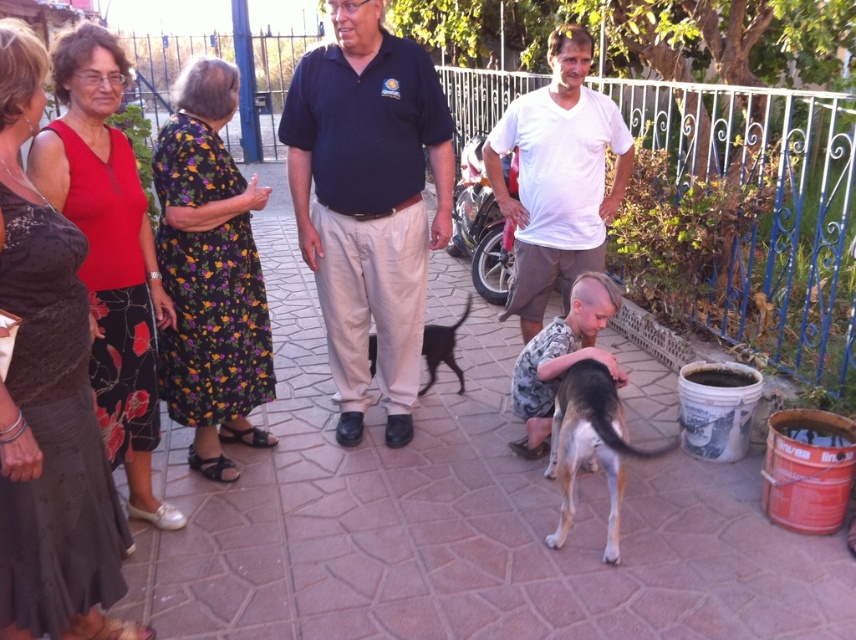
Is point (224, 458) in front of point (230, 440)?

That is True.

Identify the location of black fabric sandal at lower left. This screenshot has height=640, width=856. (212, 467).

Between dark blue cotton shirt at center and brown and white fur dog at lower center, which one appears on the left side from the viewer's perspective?

dark blue cotton shirt at center is more to the left.

Between point (377, 296) and point (625, 432), which one is positioned behind?

Positioned behind is point (377, 296).

The height and width of the screenshot is (640, 856). In order to click on dark blue cotton shirt at center in this screenshot , I will do `click(367, 202)`.

Which is below, brown and white fur dog at lower center or black fabric sandal at lower left?

Positioned lower is black fabric sandal at lower left.

Does brown and white fur dog at lower center appear on the right side of black fabric sandal at lower left?

Yes, brown and white fur dog at lower center is to the right of black fabric sandal at lower left.

I want to click on brown and white fur dog at lower center, so click(590, 444).